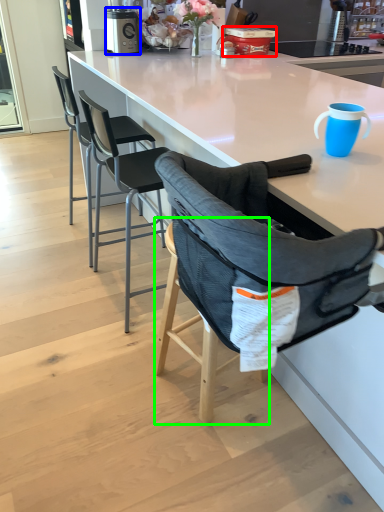
Question: Which is nearer to the appliance (highlighted by a red box)? kitchen appliance (highlighted by a blue box) or bar stool (highlighted by a green box).

Choices:
 (A) kitchen appliance
 (B) bar stool

Answer: (A)